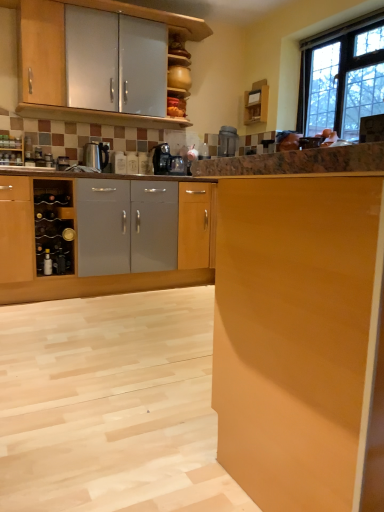
Identify the location of empty space that is ontop of light wood cabinet at lower left, the 2th cabinetry from the back (from a real-world perspective). tap(112, 320).